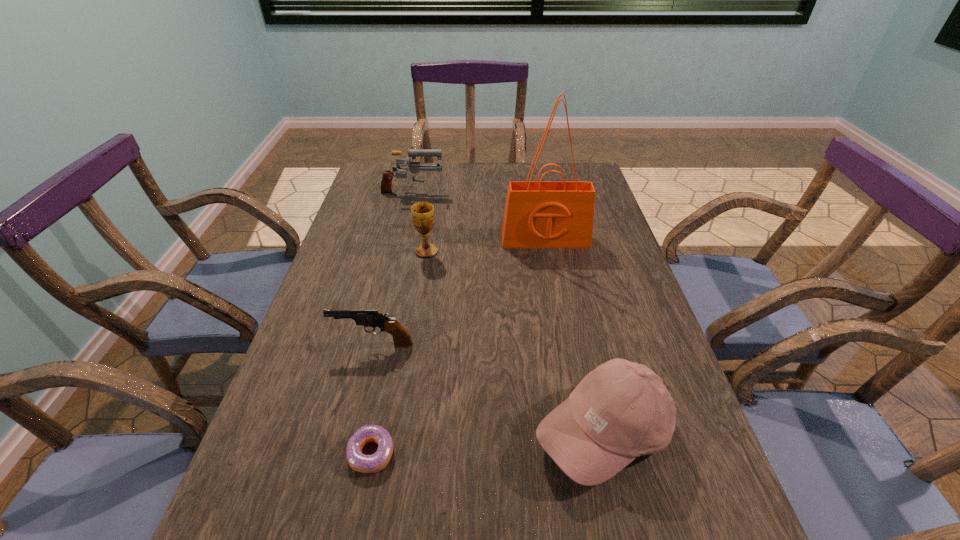
Where is `the fourth closest object to the shortest object`? the fourth closest object to the shortest object is located at coordinates (538, 214).

At what (x,y) coordinates should I click in order to perform the action: click on vacant position in the image that satisfies the following two spatial constraints: 1. at the barrel end of the farther gun; 2. on the right side of the doughnut. Please return your answer as a coordinate pair (x, y). The height and width of the screenshot is (540, 960). Looking at the image, I should click on (353, 454).

Locate an element on the screen. The image size is (960, 540). vacant space that satisfies the following two spatial constraints: 1. on the back side of the shortest object; 2. on the right side of the chalice is located at coordinates (411, 252).

Find the location of a particular element. The width and height of the screenshot is (960, 540). vacant area that satisfies the following two spatial constraints: 1. at the barrel end of the farthest object; 2. on the right side of the chalice is located at coordinates (399, 252).